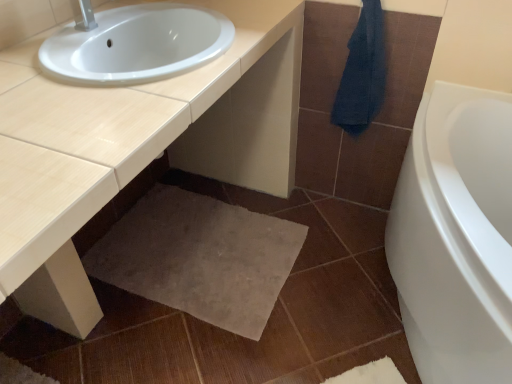
Question: From a real-world perspective, does beige carpet at lower center sit lower than beige glossy countertop at center?

Choices:
 (A) yes
 (B) no

Answer: (A)

Question: Is beige carpet at lower center next to beige glossy countertop at center and touching it?

Choices:
 (A) no
 (B) yes

Answer: (A)

Question: Is beige carpet at lower center bigger than beige glossy countertop at center?

Choices:
 (A) yes
 (B) no

Answer: (B)

Question: From the image's perspective, is beige carpet at lower center on beige glossy countertop at center?

Choices:
 (A) no
 (B) yes

Answer: (A)

Question: Is beige carpet at lower center facing away from beige glossy countertop at center?

Choices:
 (A) yes
 (B) no

Answer: (A)

Question: From a real-world perspective, is beige glossy countertop at center positioned above or below beige carpet at lower center?

Choices:
 (A) below
 (B) above

Answer: (B)

Question: Considering the positions of beige glossy countertop at center and beige carpet at lower center in the image, is beige glossy countertop at center wider or thinner than beige carpet at lower center?

Choices:
 (A) wide
 (B) thin

Answer: (B)

Question: Is point (197, 137) closer or farther from the camera than point (208, 225)?

Choices:
 (A) closer
 (B) farther

Answer: (B)

Question: Considering their positions, is beige glossy countertop at center located in front of or behind beige carpet at lower center?

Choices:
 (A) front
 (B) behind

Answer: (A)

Question: Based on their positions, is beige carpet at lower center located to the left or right of beige glossy countertop at center?

Choices:
 (A) left
 (B) right

Answer: (B)

Question: Looking at the image, does beige carpet at lower center seem bigger or smaller compared to beige glossy countertop at center?

Choices:
 (A) small
 (B) big

Answer: (A)

Question: Do you think beige carpet at lower center is within beige glossy countertop at center, or outside of it?

Choices:
 (A) outside
 (B) inside

Answer: (B)

Question: Considering their positions, is beige carpet at lower center located in front of or behind beige glossy countertop at center?

Choices:
 (A) front
 (B) behind

Answer: (B)

Question: From a real-world perspective, is dark blue towel at upper right positioned above or below beige glossy countertop at center?

Choices:
 (A) below
 (B) above

Answer: (B)

Question: Considering the positions of dark blue towel at upper right and beige glossy countertop at center in the image, is dark blue towel at upper right wider or thinner than beige glossy countertop at center?

Choices:
 (A) wide
 (B) thin

Answer: (B)